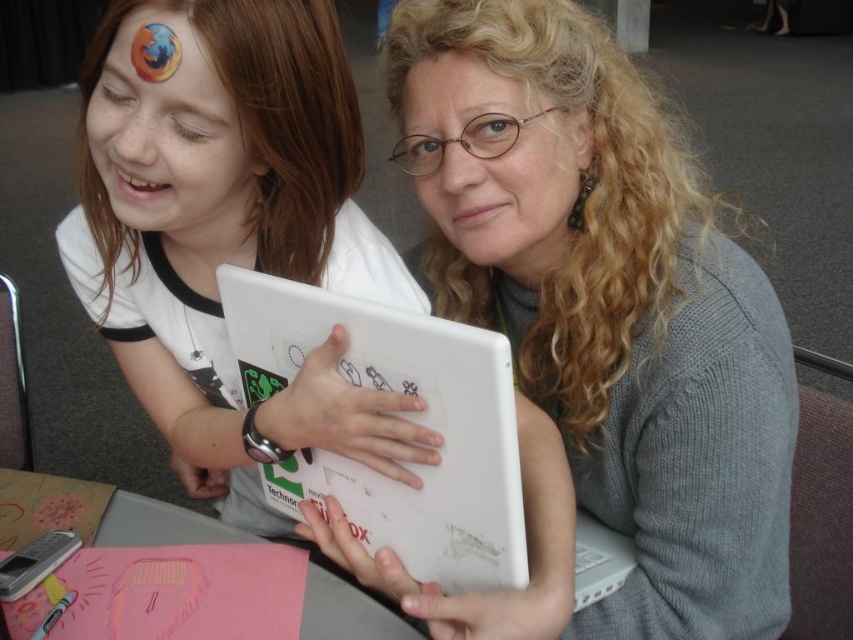
Question: Which object is farther from the camera taking this photo?

Choices:
 (A) matte gray face at center
 (B) matte white face at upper left
 (C) white matte laptop at center
 (D) white matte tablet at center

Answer: (A)

Question: Which object appears farthest from the camera in this image?

Choices:
 (A) matte gray face at center
 (B) white matte tablet at center
 (C) white matte laptop at center

Answer: (A)

Question: Considering the real-world distances, which object is closest to the matte white face at upper left?

Choices:
 (A) white matte laptop at center
 (B) matte gray face at center
 (C) matte white laptop at center

Answer: (A)

Question: Does matte white laptop at center have a larger size compared to white matte tablet at center?

Choices:
 (A) no
 (B) yes

Answer: (A)

Question: Where is white matte tablet at center located in relation to white matte laptop at center in the image?

Choices:
 (A) right
 (B) left

Answer: (B)

Question: Does matte white laptop at center appear on the left side of matte white face at upper left?

Choices:
 (A) no
 (B) yes

Answer: (A)